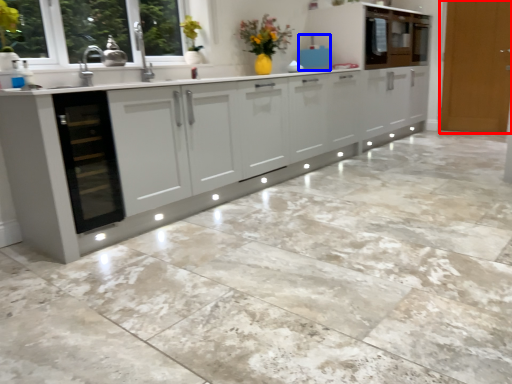
Question: Among these objects, which one is farthest to the camera, door (highlighted by a red box) or appliance (highlighted by a blue box)?

Choices:
 (A) door
 (B) appliance

Answer: (A)